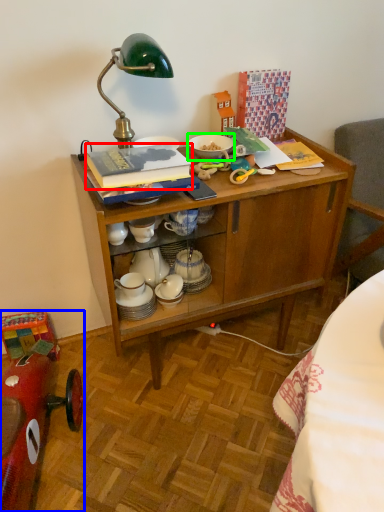
Question: Based on their relative distances, which object is nearer to book (highlighted by a red box)? Choose from model car (highlighted by a blue box) and tableware (highlighted by a green box).

Choices:
 (A) model car
 (B) tableware

Answer: (B)